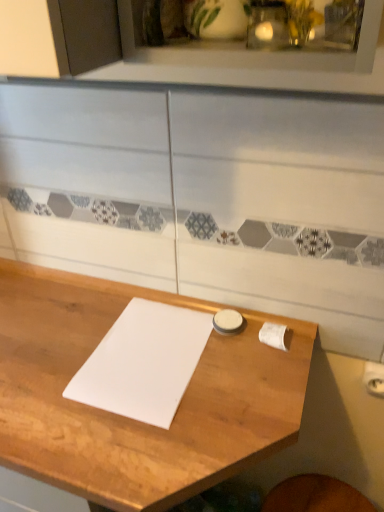
Find the location of `empty space that is ontop of white matte journal at center`. empty space that is ontop of white matte journal at center is located at coordinates (144, 352).